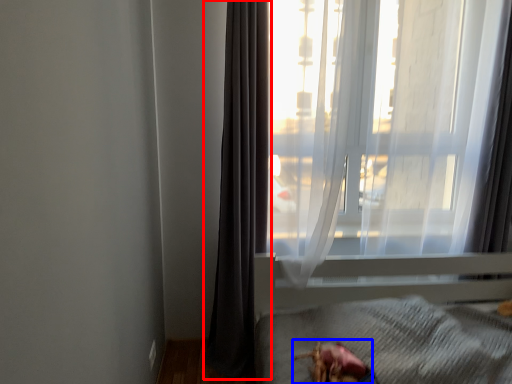
Question: Among these objects, which one is nearest to the camera, curtain (highlighted by a red box) or animal (highlighted by a blue box)?

Choices:
 (A) curtain
 (B) animal

Answer: (B)